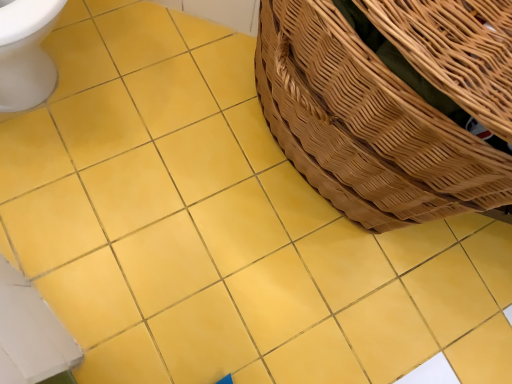
I want to click on free region under brown woven picnic basket at right (from a real-world perspective), so point(272,178).